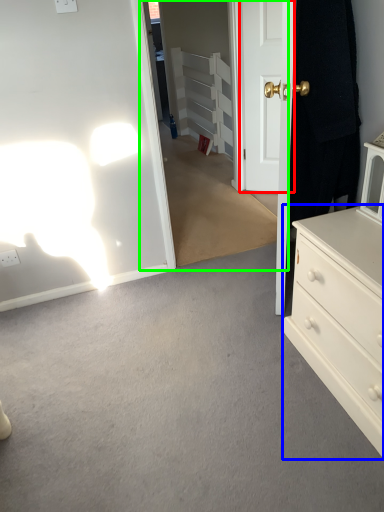
Question: Which object is the farthest from door (highlighted by a red box)? Choose among these: chest of drawers (highlighted by a blue box) or glass door (highlighted by a green box).

Choices:
 (A) chest of drawers
 (B) glass door

Answer: (A)